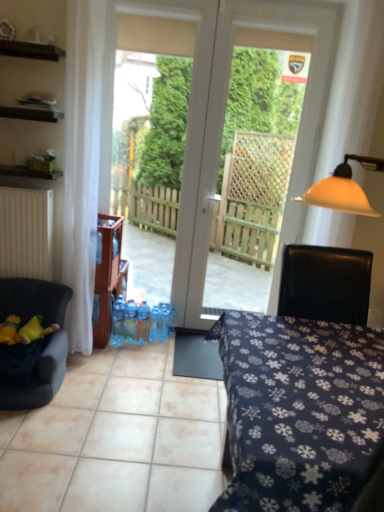
What are the coordinates of `free spot to the right of wooden cabinet at left` in the screenshot? It's located at (141, 350).